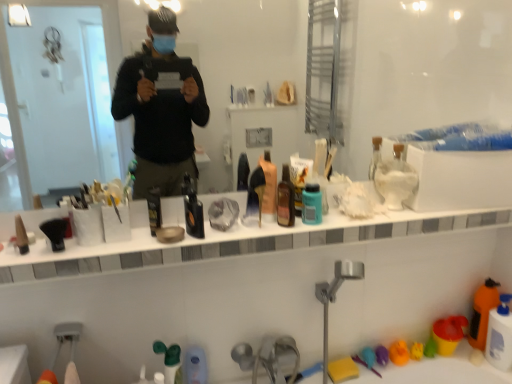
Where is `vacant area located to the right-hand side of teal matte bottle at center, which ranks as the 1th mouthwash in right-to-left order`? vacant area located to the right-hand side of teal matte bottle at center, which ranks as the 1th mouthwash in right-to-left order is located at coordinates (351, 221).